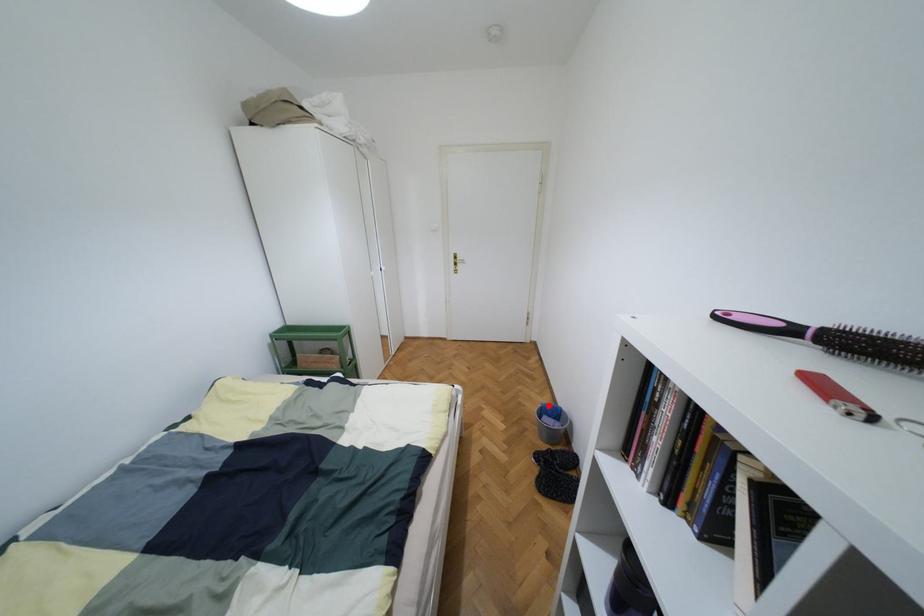
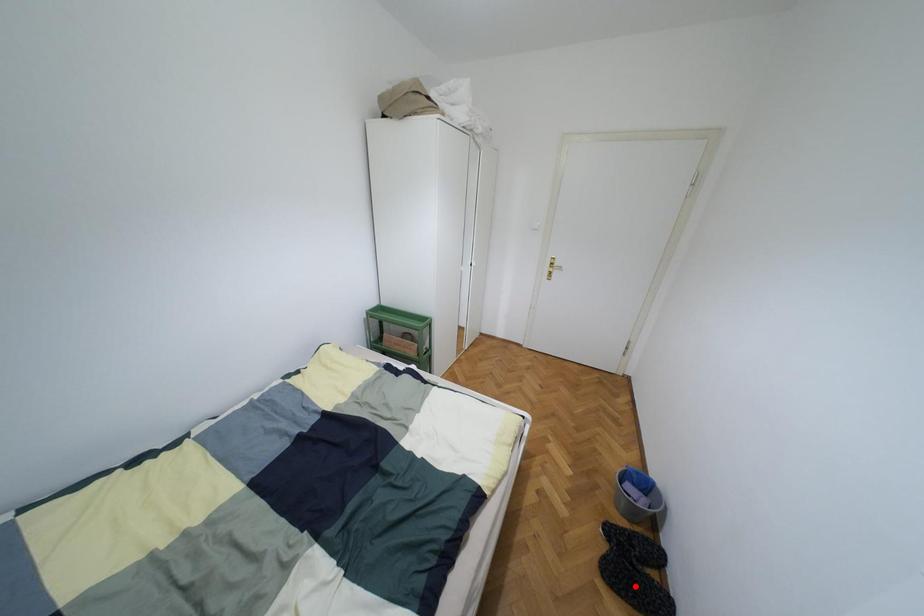
I am providing you with two images of the same scene from different viewpoints. A red point is marked on the first image and another point is marked on the second image. Is the marked point in image1 the same physical position as the marked point in image2?

No